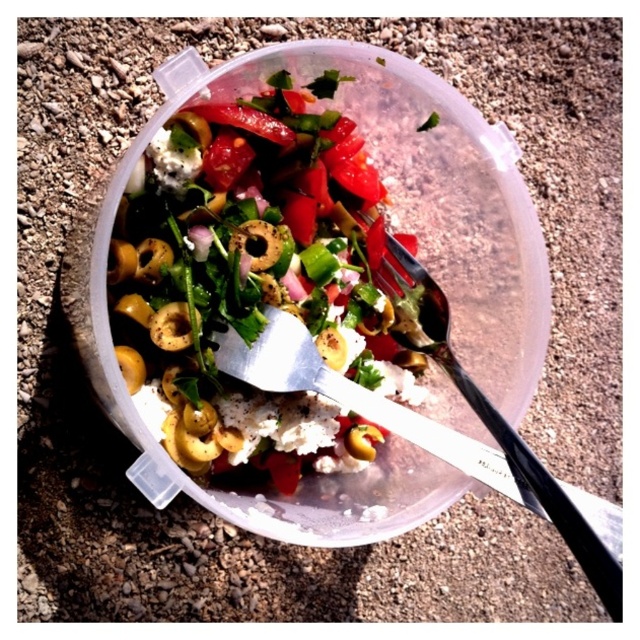
Image resolution: width=640 pixels, height=640 pixels. What do you see at coordinates (250, 275) in the screenshot?
I see `shiny plastic salad bowl at center` at bounding box center [250, 275].

Who is more forward, (390,353) or (378,273)?

Point (378,273) is in front.

Who is more distant from viewer, (262, 216) or (554, 497)?

The point (262, 216) is more distant.

Where is `shiny plastic salad bowl at center`? The width and height of the screenshot is (640, 640). shiny plastic salad bowl at center is located at coordinates (250, 275).